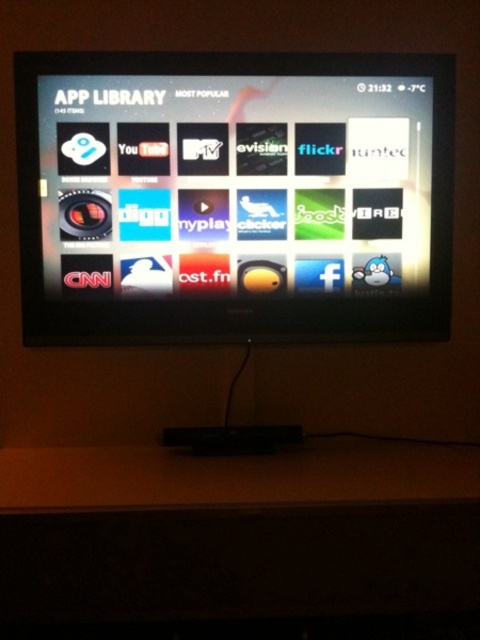
Question: Where is black glossy tv at center located in relation to wooden table at lower center in the image?

Choices:
 (A) right
 (B) left

Answer: (B)

Question: Considering the relative positions of black glossy tv at center and wooden table at lower center in the image provided, where is black glossy tv at center located with respect to wooden table at lower center?

Choices:
 (A) right
 (B) left

Answer: (B)

Question: Which point is farther to the camera?

Choices:
 (A) (120, 193)
 (B) (199, 464)

Answer: (A)

Question: Does black glossy tv at center come behind wooden table at lower center?

Choices:
 (A) no
 (B) yes

Answer: (B)